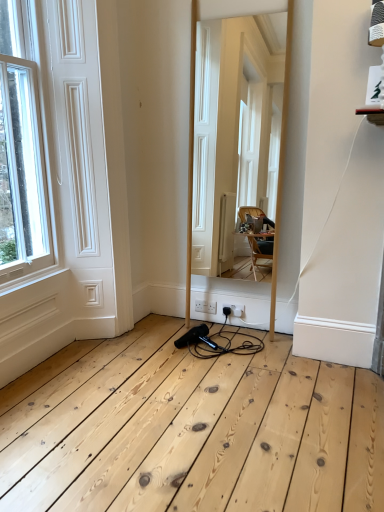
This screenshot has width=384, height=512. What do you see at coordinates (227, 130) in the screenshot?
I see `wooden mirror at center` at bounding box center [227, 130].

Locate an element on the screen. The width and height of the screenshot is (384, 512). wooden mirror at center is located at coordinates (227, 130).

Measure the distance between wooden mirror at center and camera.

3.84 meters.

The width and height of the screenshot is (384, 512). I want to click on wooden mirror at center, so click(x=227, y=130).